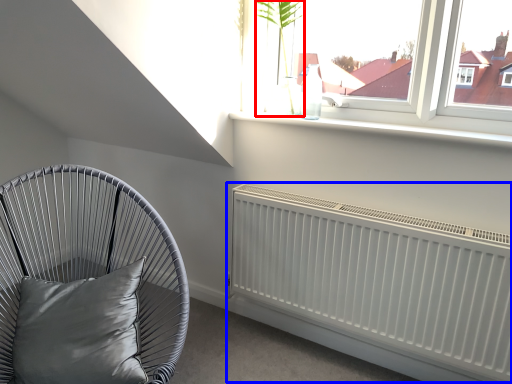
Question: Which point is further to the camera, plant (highlighted by a red box) or radiator (highlighted by a blue box)?

Choices:
 (A) plant
 (B) radiator

Answer: (A)